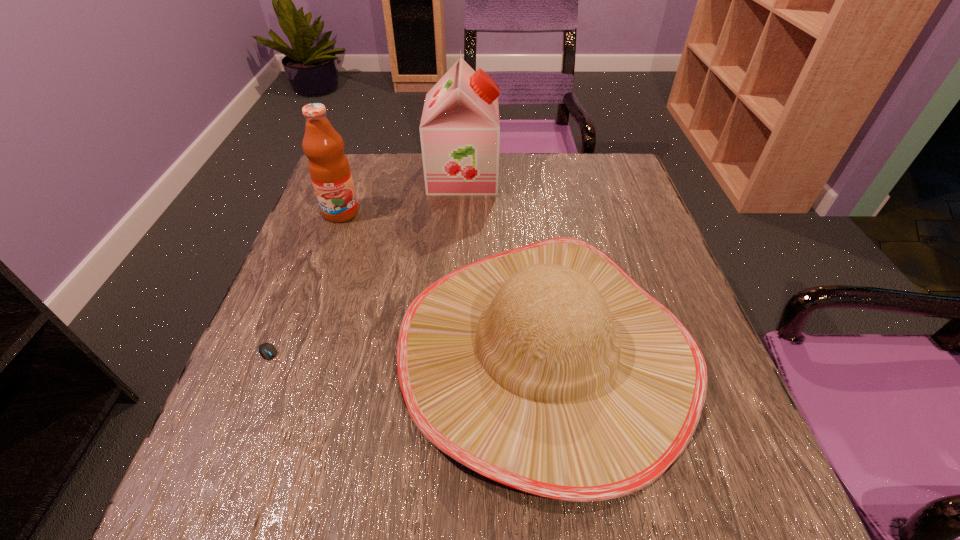
Where is `free location at the far left corner`? The height and width of the screenshot is (540, 960). free location at the far left corner is located at coordinates (363, 176).

Where is `vacant space at the far right corner of the desktop`? The image size is (960, 540). vacant space at the far right corner of the desktop is located at coordinates (600, 154).

Where is `vacant point located between the soya milk and the mouse`? This screenshot has height=540, width=960. vacant point located between the soya milk and the mouse is located at coordinates (368, 268).

Locate an element on the screen. The height and width of the screenshot is (540, 960). vacant space that is in between the farthest object and the mouse is located at coordinates (368, 268).

Identify the location of free point between the soya milk and the shortest object. This screenshot has height=540, width=960. (368, 268).

You are a GUI agent. You are given a task and a screenshot of the screen. Output one action in this format:
    pyautogui.click(x=<x>, y=<y>)
    Task: Click on the empty location between the farthest object and the shortest object
    
    Given the screenshot: What is the action you would take?
    pyautogui.click(x=368, y=268)

Find the location of a particular element. This screenshot has height=540, width=960. empty location between the mouse and the fruit juice is located at coordinates (307, 287).

Locate an element on the screen. This screenshot has height=540, width=960. empty location between the mouse and the second farthest object is located at coordinates (307, 287).

Locate an element on the screen. the closest object to the shortest object is located at coordinates (547, 368).

What are the coordinates of `object that stands as the closest to the fruit juice` in the screenshot? It's located at (460, 129).